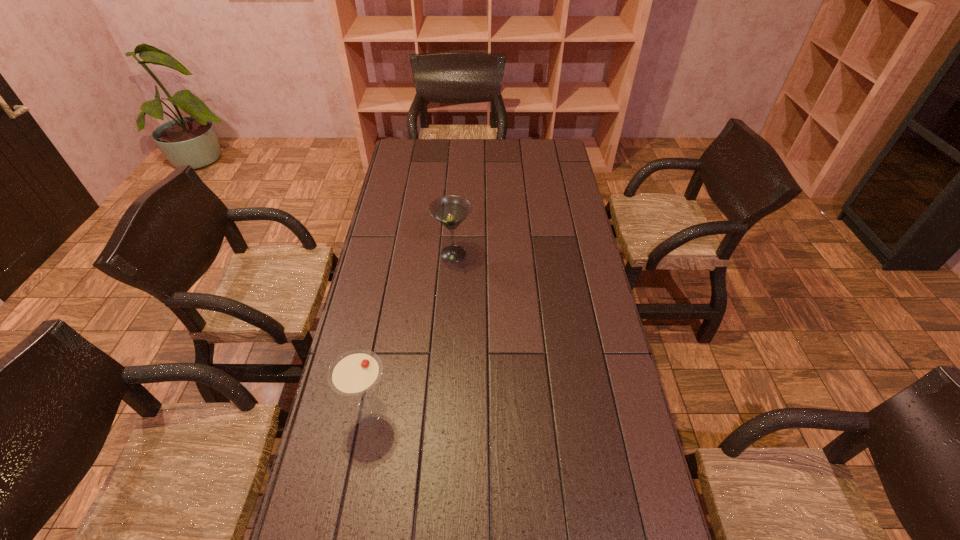
This screenshot has width=960, height=540. What are the coordinates of `blank space at the far right corner of the desktop` in the screenshot? It's located at (565, 157).

Find the location of a particular element. The height and width of the screenshot is (540, 960). free space between the nearer object and the right object is located at coordinates (412, 333).

I want to click on free space that is in between the right object and the shorter object, so click(412, 333).

This screenshot has height=540, width=960. Find the location of `free space between the right object and the shorter object`. free space between the right object and the shorter object is located at coordinates (412, 333).

At what (x,y) coordinates should I click in order to perform the action: click on free spot that satisfies the following two spatial constraints: 1. on the back side of the right martini; 2. on the right side of the left object. Please return your answer as a coordinate pair (x, y). The image size is (960, 540). Looking at the image, I should click on (399, 254).